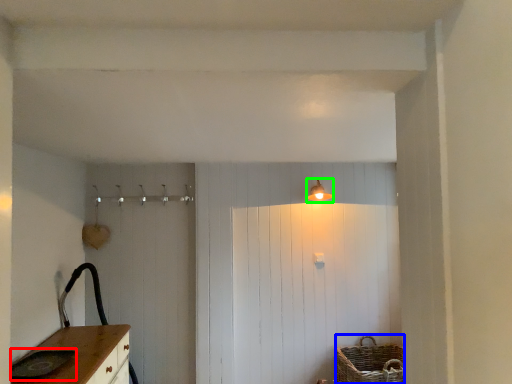
Question: Which object is the farthest from sink (highlighted by a red box)? Choose among these: basket (highlighted by a blue box) or light fixture (highlighted by a green box).

Choices:
 (A) basket
 (B) light fixture

Answer: (B)